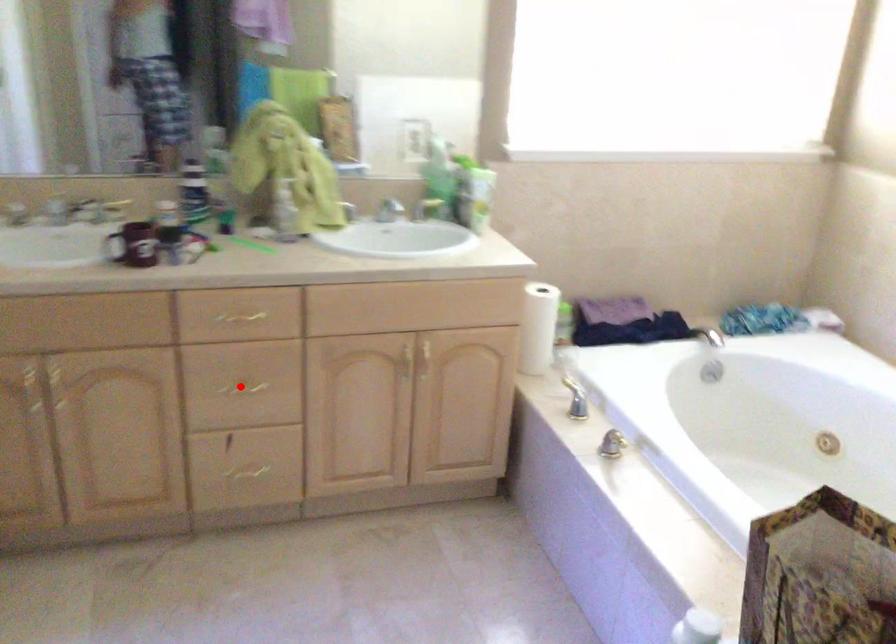
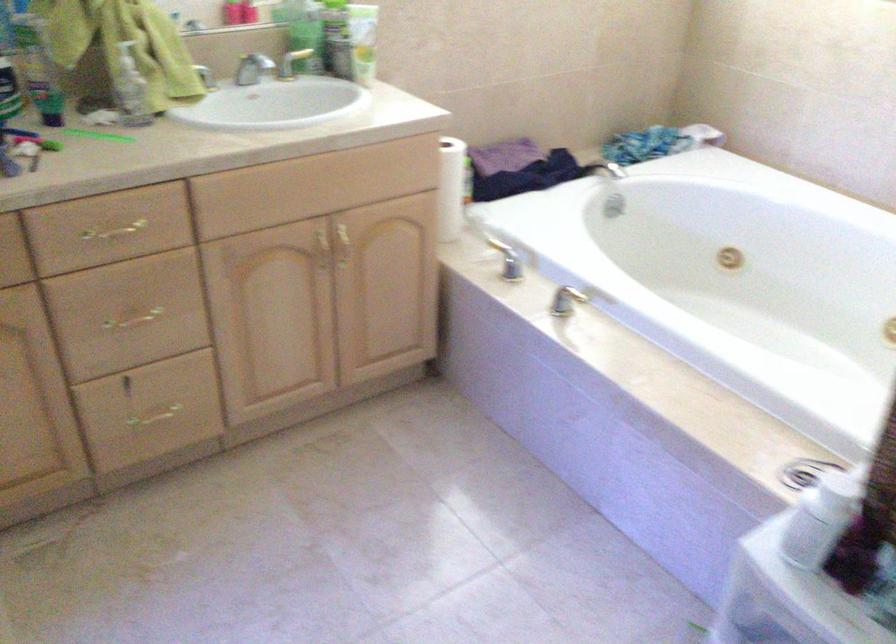
Find the pixel in the second image that matches the highlighted location in the first image.

(133, 317)